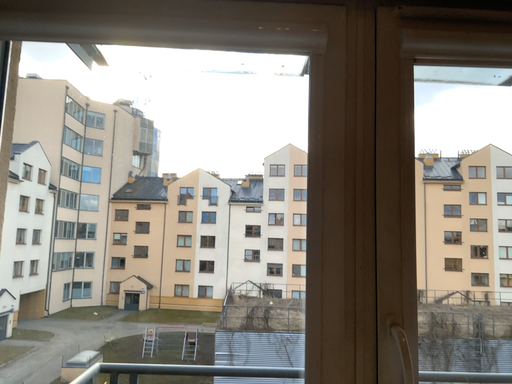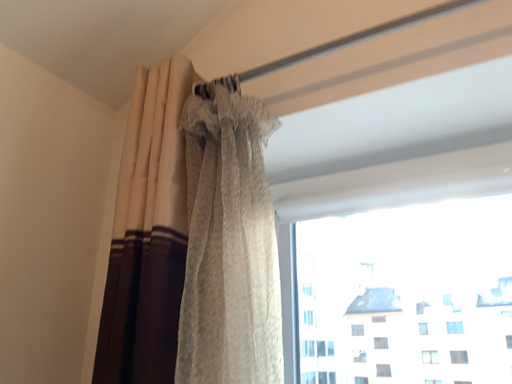
Question: Which way did the camera rotate in the video?

Choices:
 (A) rotated downward
 (B) rotated upward

Answer: (B)